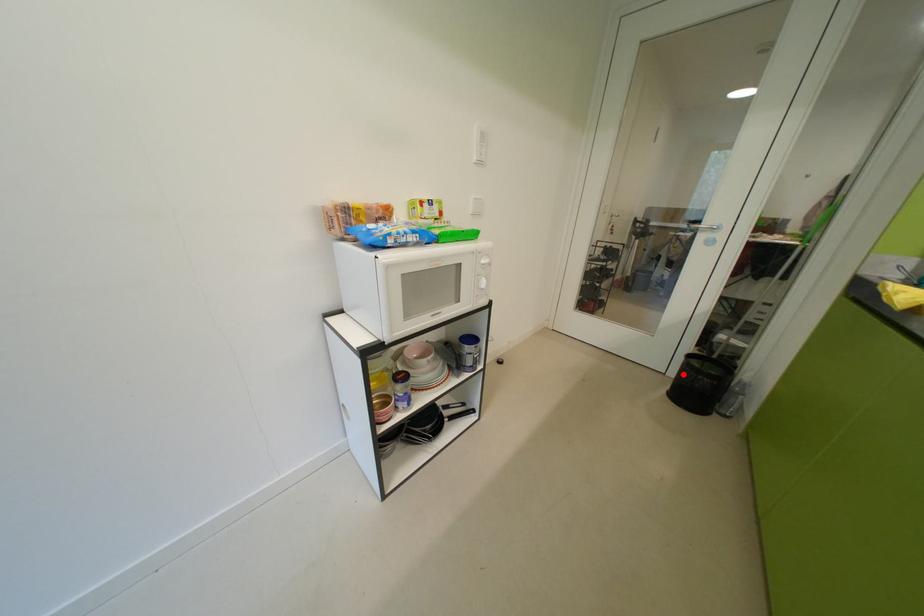
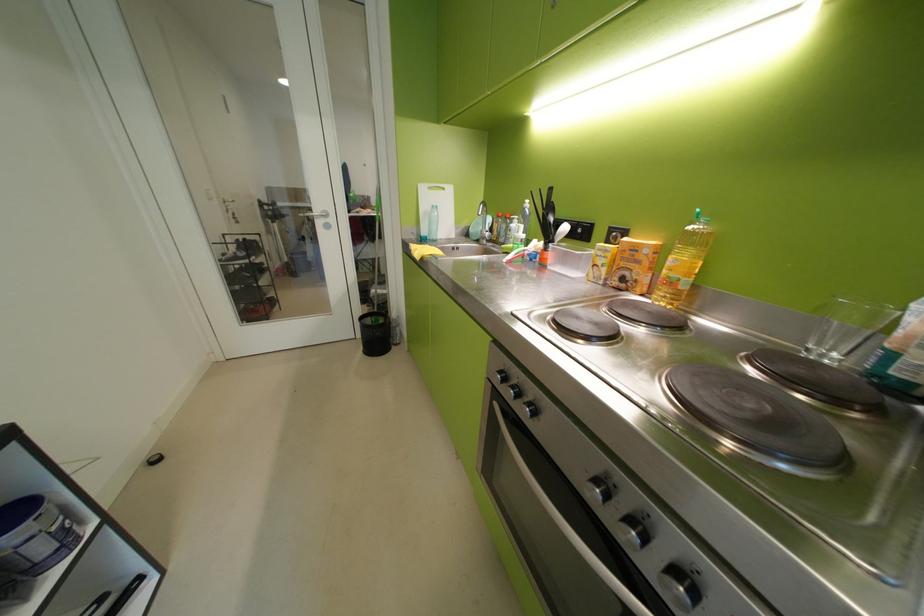
Question: A red point is marked in image1. In image2, is the corresponding 3D point closer to the camera or farther? Reply with the corresponding letter.

Choices:
 (A) The corresponding 3D point is closer.
 (B) The corresponding 3D point is farther.

Answer: (B)